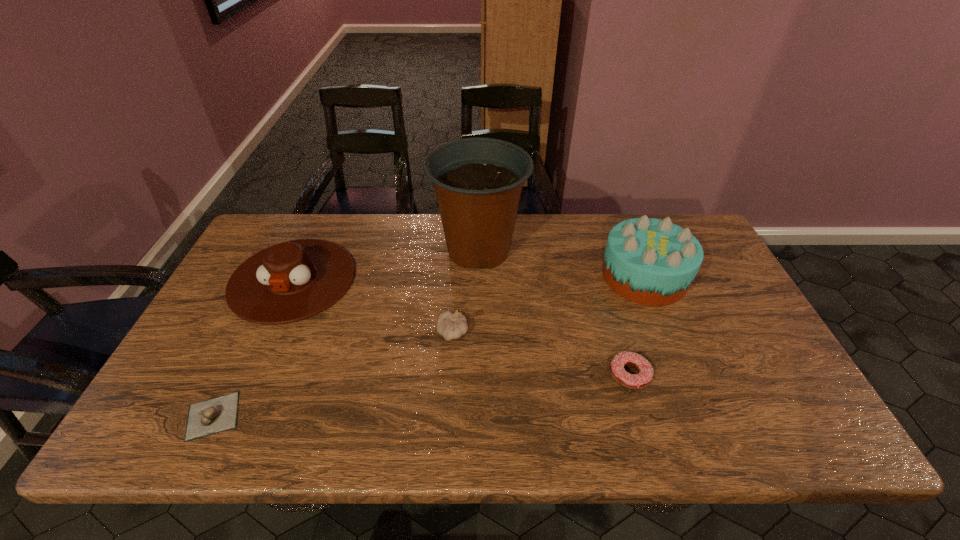
Find the location of a particular element. vacant area situated 0.280m on the front-facing side of the cowboy hat is located at coordinates (228, 422).

Find the location of a particular element. This screenshot has width=960, height=540. free location located 0.070m on the back of the farther garlic is located at coordinates (455, 302).

Where is `free point located on the right of the fifth tallest object`? free point located on the right of the fifth tallest object is located at coordinates point(696,375).

Identify the location of free location located on the back of the left garlic. This screenshot has height=540, width=960. (252, 335).

This screenshot has height=540, width=960. I want to click on flowerpot located in the far edge section of the desktop, so click(478, 181).

At what (x,y) coordinates should I click in order to perform the action: click on cake present at the far edge. Please return your answer as a coordinate pair (x, y). Image resolution: width=960 pixels, height=540 pixels. Looking at the image, I should click on (649, 261).

Locate an element on the screen. Image resolution: width=960 pixels, height=540 pixels. cowboy hat that is positioned at the far edge is located at coordinates (291, 281).

Locate an element on the screen. object that is at the near edge is located at coordinates (212, 416).

Image resolution: width=960 pixels, height=540 pixels. What are the coordinates of `cowboy hat at the left edge` in the screenshot? It's located at (291, 281).

Where is `garlic that is at the left edge`? garlic that is at the left edge is located at coordinates (212, 416).